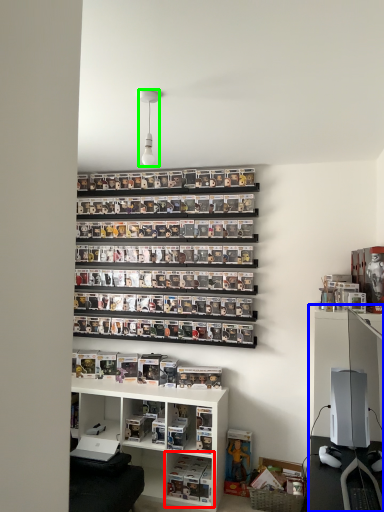
Question: Which object is the farthest from shelf (highlighted by a red box)? Choose among these: entertainment center (highlighted by a blue box) or light fixture (highlighted by a green box).

Choices:
 (A) entertainment center
 (B) light fixture

Answer: (B)